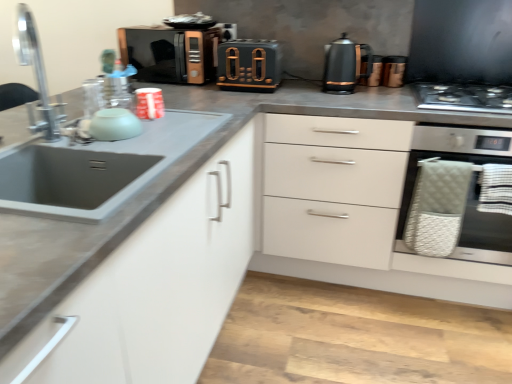
Question: Is matte black microwave at upper center, the fourth appliance positioned from the right, closer to the viewer compared to matte black toaster at center, which appears as the 4th appliance when viewed from the back?

Choices:
 (A) no
 (B) yes

Answer: (A)

Question: Does matte black microwave at upper center, the 2th appliance in the left-to-right sequence, have a larger size compared to matte black toaster at center, which ranks as the third appliance in right-to-left order?

Choices:
 (A) no
 (B) yes

Answer: (B)

Question: From the image's perspective, is matte black microwave at upper center, the third appliance positioned from the back, under matte black toaster at center, the 3th appliance when ordered from left to right?

Choices:
 (A) yes
 (B) no

Answer: (B)

Question: Is matte black microwave at upper center, the 2th appliance in the left-to-right sequence, looking in the opposite direction of matte black toaster at center, which ranks as the third appliance in right-to-left order?

Choices:
 (A) yes
 (B) no

Answer: (B)

Question: From the image's perspective, is matte black microwave at upper center, which is the third appliance from front to back, on matte black toaster at center, the 3th appliance when ordered from left to right?

Choices:
 (A) no
 (B) yes

Answer: (B)

Question: From their relative heights in the image, would you say metallic copper kettle at upper right, the second appliance from the back, is taller or shorter than silver metallic faucet at left?

Choices:
 (A) tall
 (B) short

Answer: (B)

Question: From the image's perspective, is metallic copper kettle at upper right, which ranks as the fourth appliance in front-to-back order, above or below silver metallic faucet at left?

Choices:
 (A) above
 (B) below

Answer: (A)

Question: Looking at the image, does metallic copper kettle at upper right, which is counted as the fifth appliance, starting from the left, seem bigger or smaller compared to silver metallic faucet at left?

Choices:
 (A) big
 (B) small

Answer: (B)

Question: Is metallic copper kettle at upper right, which ranks as the fourth appliance in front-to-back order, in front of or behind silver metallic faucet at left in the image?

Choices:
 (A) behind
 (B) front

Answer: (A)

Question: Considering the positions of metallic copper kettle at upper right, placed as the first appliance when sorted from right to left, and copper metallic toaster at center, which is the 2th appliance from right to left, in the image, is metallic copper kettle at upper right, placed as the first appliance when sorted from right to left, bigger or smaller than copper metallic toaster at center, which is the 2th appliance from right to left,?

Choices:
 (A) big
 (B) small

Answer: (A)

Question: Is metallic copper kettle at upper right, the second appliance from the back, inside or outside of copper metallic toaster at center, arranged as the 5th appliance when viewed from the front?

Choices:
 (A) outside
 (B) inside

Answer: (A)

Question: Based on their positions, is metallic copper kettle at upper right, placed as the first appliance when sorted from right to left, located to the left or right of copper metallic toaster at center, positioned as the 1th appliance in back-to-front order?

Choices:
 (A) left
 (B) right

Answer: (B)

Question: Does point click(385, 66) appear closer or farther from the camera than point click(381, 62)?

Choices:
 (A) closer
 (B) farther

Answer: (A)

Question: Is point (389, 72) closer or farther from the camera than point (400, 228)?

Choices:
 (A) closer
 (B) farther

Answer: (B)

Question: In terms of width, does metallic copper kettle at upper right, which is counted as the fifth appliance, starting from the left, look wider or thinner when compared to stainless steel oven at right?

Choices:
 (A) thin
 (B) wide

Answer: (A)